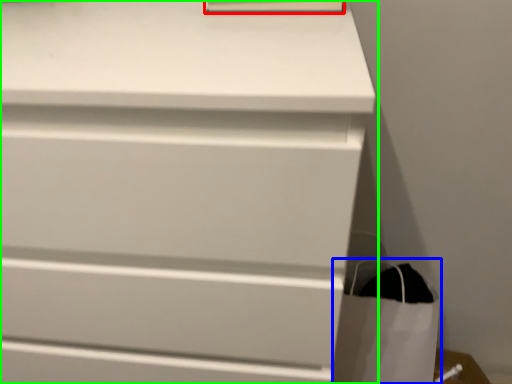
Question: Considering the real-world distances, which object is closest to paperback book (highlighted by a red box)? shopping bag (highlighted by a blue box) or chest of drawers (highlighted by a green box).

Choices:
 (A) shopping bag
 (B) chest of drawers

Answer: (B)